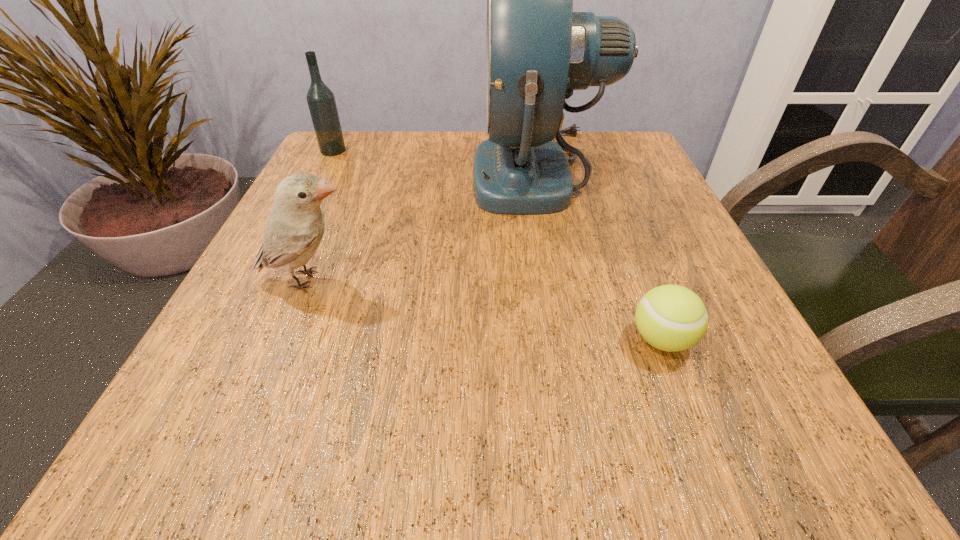
Image resolution: width=960 pixels, height=540 pixels. I want to click on vacant space located on the back of the shortest object, so click(633, 262).

This screenshot has height=540, width=960. I want to click on fan situated at the far edge, so click(x=538, y=50).

In order to click on vodka at the far edge in this screenshot , I will do `click(321, 101)`.

Identify the location of vodka that is at the left edge. (321, 101).

Where is `bird located in the left edge section of the desktop`? The height and width of the screenshot is (540, 960). bird located in the left edge section of the desktop is located at coordinates (295, 226).

The image size is (960, 540). What are the coordinates of `fan present at the right edge` in the screenshot? It's located at (538, 50).

You are a GUI agent. You are given a task and a screenshot of the screen. Output one action in this format:
    pyautogui.click(x=<x>, y=<y>)
    Task: Click on the tennis ball present at the right edge
    
    Given the screenshot: What is the action you would take?
    pyautogui.click(x=672, y=318)

Locate an element on the screen. The image size is (960, 540). object present at the far left corner is located at coordinates (321, 101).

Where is `object located in the far right corner section of the desktop`? object located in the far right corner section of the desktop is located at coordinates (538, 50).

Where is `vacant region at the far edge`? vacant region at the far edge is located at coordinates (469, 174).